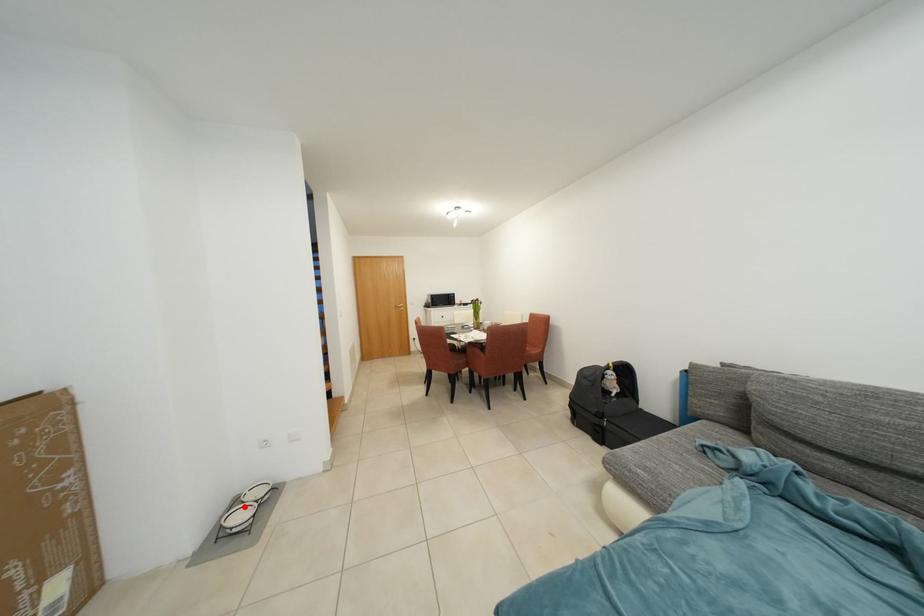
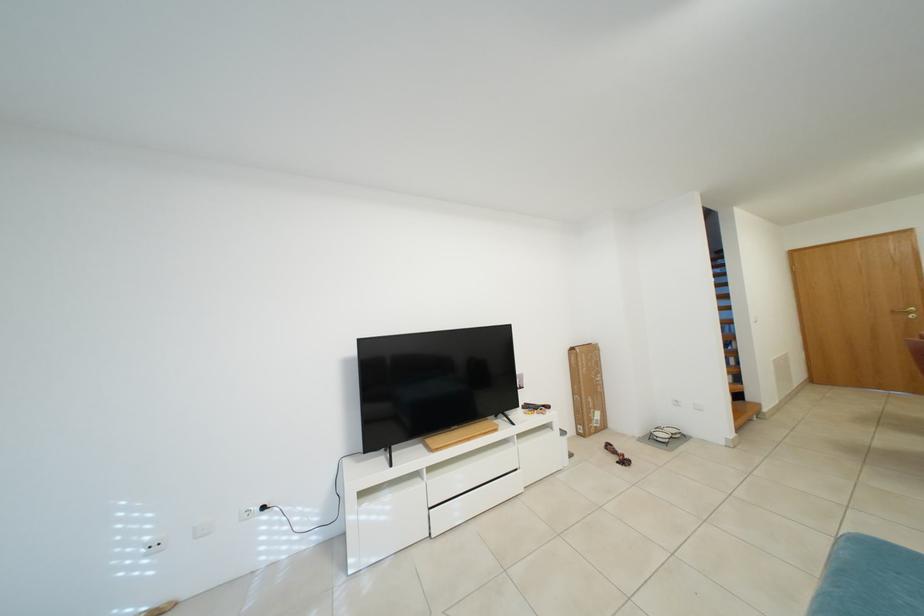
Find the pixel in the second image that matches the highlighted location in the first image.

(666, 432)